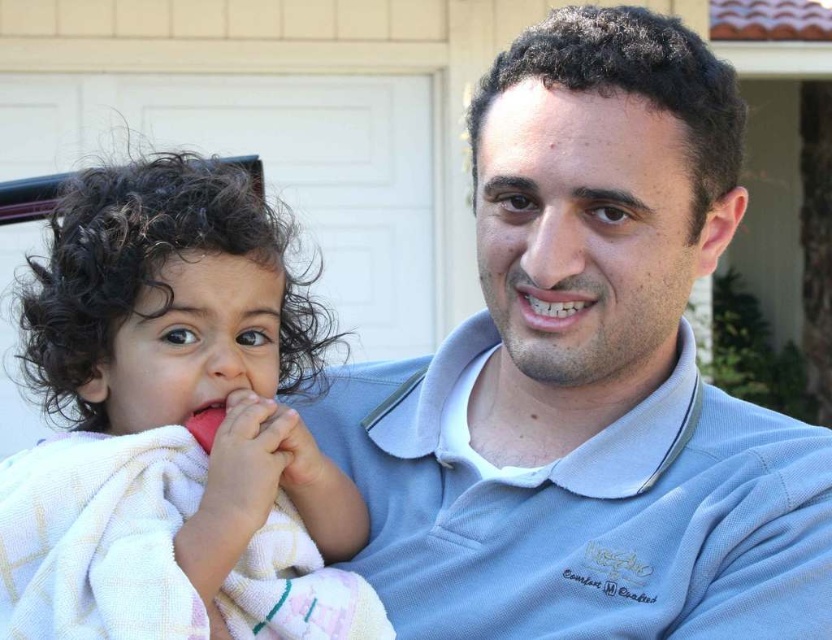
Question: Estimate the real-world distances between objects in this image. Which object is closer to the white glossy teeth at center?

Choices:
 (A) curly-haired baby at left
 (B) light blue cotton polo shirt at center
 (C) dark curly hair at upper center

Answer: (C)

Question: Which of the following is the farthest from the observer?

Choices:
 (A) (197, 186)
 (B) (706, 512)
 (C) (558, 307)

Answer: (C)

Question: Is curly-haired baby at left bigger than light blue cotton polo shirt at center?

Choices:
 (A) no
 (B) yes

Answer: (B)

Question: Can you confirm if light blue cotton polo shirt at center is smaller than white glossy teeth at center?

Choices:
 (A) no
 (B) yes

Answer: (A)

Question: Can you confirm if light blue cotton polo shirt at center is positioned to the right of dark curly hair at upper center?

Choices:
 (A) no
 (B) yes

Answer: (A)

Question: Which object appears farthest from the camera in this image?

Choices:
 (A) white glossy teeth at center
 (B) curly-haired baby at left
 (C) light blue cotton polo shirt at center

Answer: (A)